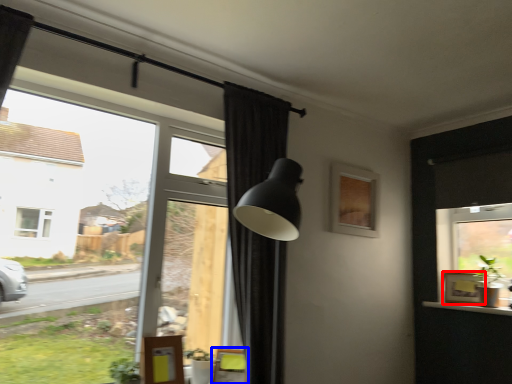
Question: Among these objects, which one is farthest to the camera, picture frame (highlighted by a red box) or swivel chair (highlighted by a blue box)?

Choices:
 (A) picture frame
 (B) swivel chair

Answer: (A)